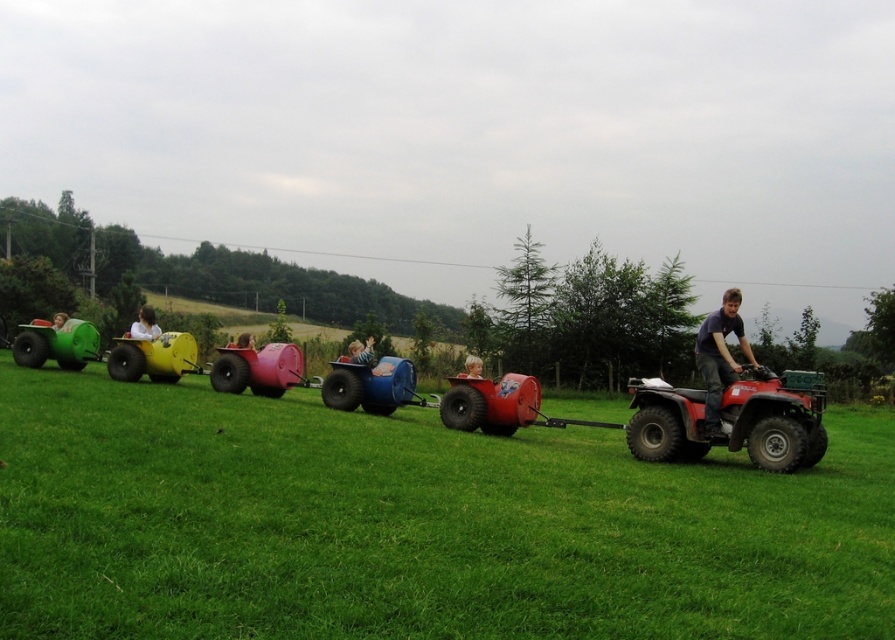
Based on the photo, who is lower down, blonde hair at center or matte green cart at left?

blonde hair at center is below.

At what (x,y) coordinates should I click in order to perform the action: click on blonde hair at center. Please return your answer as a coordinate pair (x, y). Image resolution: width=895 pixels, height=640 pixels. Looking at the image, I should click on (472, 368).

Image resolution: width=895 pixels, height=640 pixels. I want to click on blonde hair at center, so click(472, 368).

Measure the distance between point (744, 346) and camera.

Point (744, 346) is 11.17 meters from camera.

Who is more forward, (717, 316) or (148, 339)?

Point (717, 316)

Which is in front, point (726, 320) or point (141, 317)?

Point (726, 320) is in front.

Find the location of a particular element. dark blue shirt at right is located at coordinates (719, 356).

Between point (475, 548) and point (133, 333), which one is positioned in front?

Point (475, 548)

Who is higher up, rubberized plastic cart at center or white fabric person at center?

white fabric person at center

Does point (107, 408) come closer to viewer compared to point (141, 330)?

Yes, point (107, 408) is closer to viewer.

Locate an element on the screen. rubberized plastic cart at center is located at coordinates (415, 524).